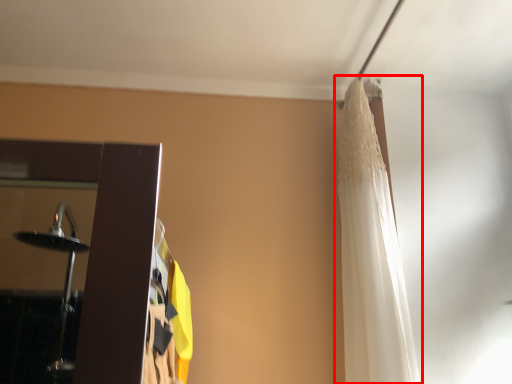
Question: From the image's perspective, considering the relative positions of curtain (annotated by the red box) and curtain in the image provided, where is curtain (annotated by the red box) located with respect to the staircase?

Choices:
 (A) below
 (B) above

Answer: (B)